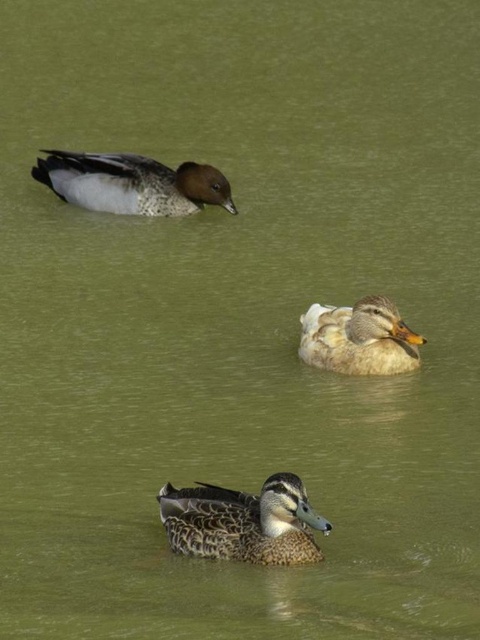
Is speckled feathered duck at center below white fluffy duck at center?

Indeed, speckled feathered duck at center is positioned under white fluffy duck at center.

Measure the distance between speckled feathered duck at center and white fluffy duck at center.

2.00 meters

Between point (324, 522) and point (375, 371), which one is positioned behind?

Positioned behind is point (375, 371).

Find the location of a particular element. Image resolution: width=480 pixels, height=640 pixels. speckled feathered duck at center is located at coordinates (242, 522).

Is speckled feathered duck at upper left above white fluffy duck at center?

Yes, speckled feathered duck at upper left is above white fluffy duck at center.

Identify the location of speckled feathered duck at upper left. The height and width of the screenshot is (640, 480). (132, 182).

Is speckled feathered duck at center to the left of speckled feathered duck at upper left from the viewer's perspective?

In fact, speckled feathered duck at center is to the right of speckled feathered duck at upper left.

Between point (302, 513) and point (196, 204), which one is positioned in front?

Positioned in front is point (302, 513).

Identify the location of speckled feathered duck at center. (242, 522).